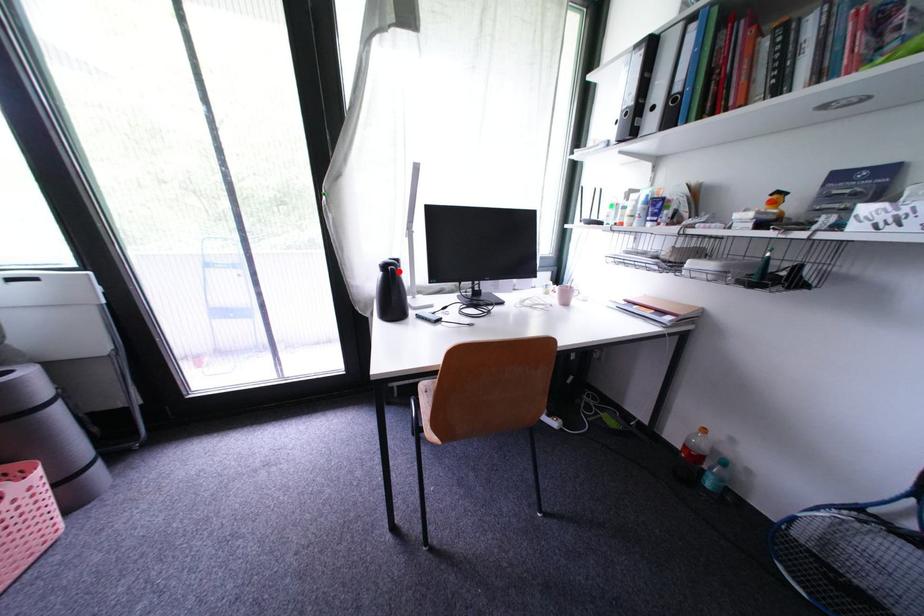
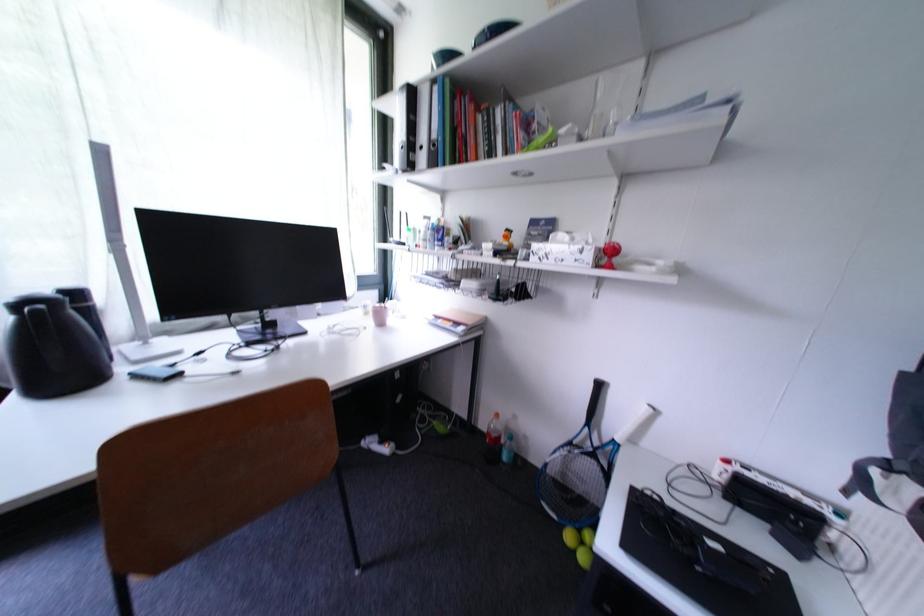
Locate, in the second image, the point that corresponds to the highlighted location in the first image.

(43, 313)